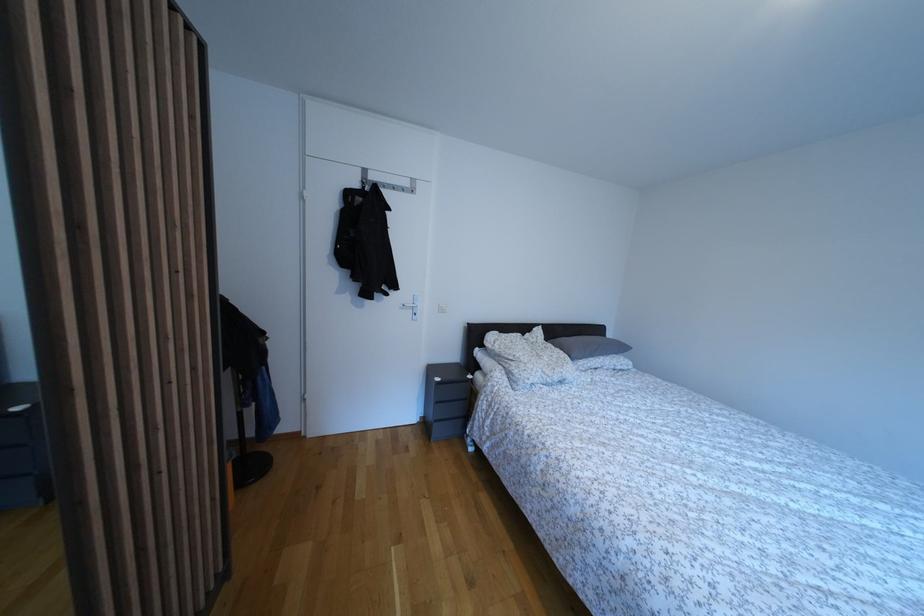
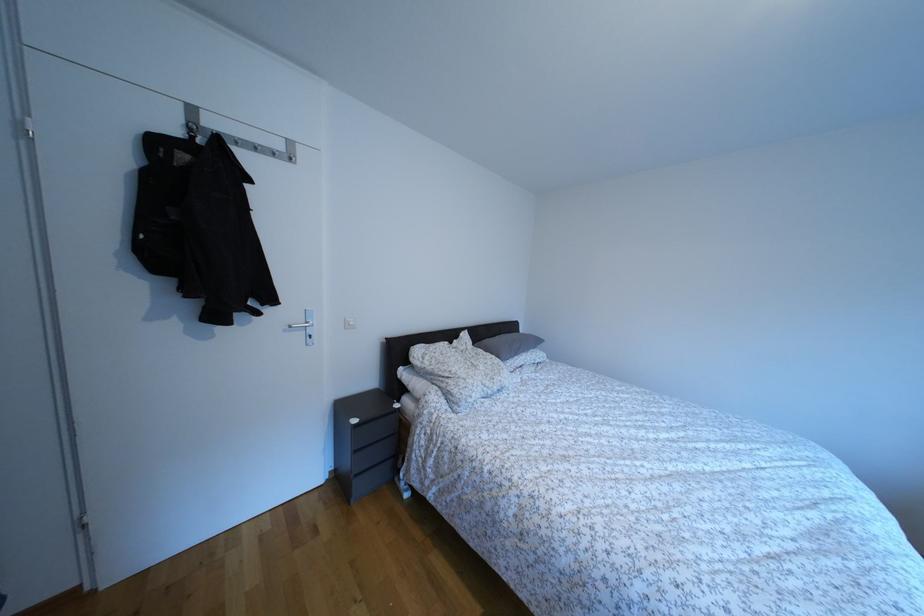
Question: The first image is from the beginning of the video and the second image is from the end. How did the camera likely rotate when shooting the video?

Choices:
 (A) Left
 (B) Right
 (C) Up
 (D) Down

Answer: (B)